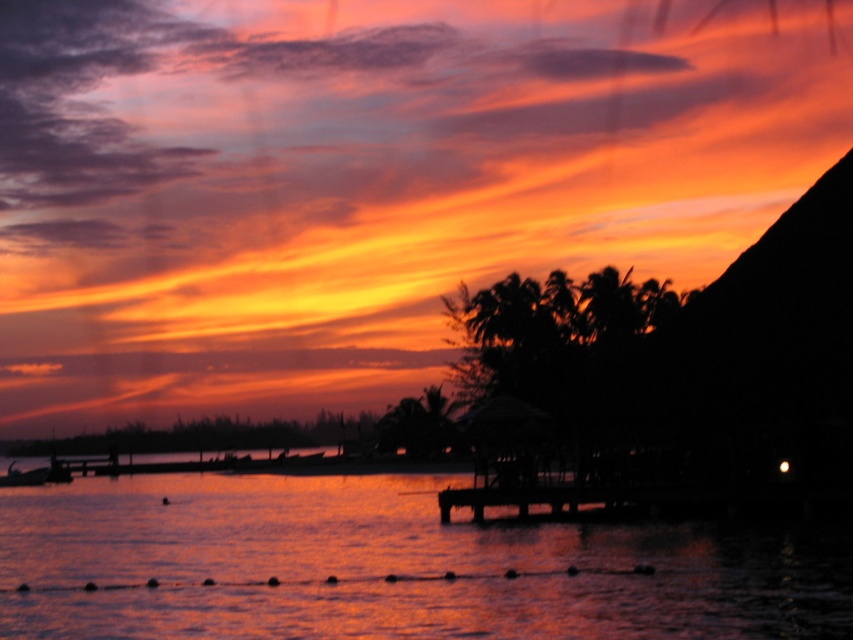
Question: Is shiny reflective water at center closer to camera compared to black wood dock at center?

Choices:
 (A) no
 (B) yes

Answer: (B)

Question: Does shiny reflective water at center have a smaller size compared to black wood dock at center?

Choices:
 (A) yes
 (B) no

Answer: (B)

Question: Estimate the real-world distances between objects in this image. Which object is farther from the shiny reflective water at center?

Choices:
 (A) black wood dock at center
 (B) metallic silver boat at lower left

Answer: (B)

Question: Is shiny reflective water at center above black wood dock at center?

Choices:
 (A) no
 (B) yes

Answer: (A)

Question: Which point appears closest to the camera in this image?

Choices:
 (A) (x=445, y=497)
 (B) (x=357, y=579)
 (C) (x=15, y=480)

Answer: (B)

Question: Which object is the farthest from the black wood dock at center?

Choices:
 (A) metallic silver boat at lower left
 (B) shiny reflective water at center

Answer: (A)